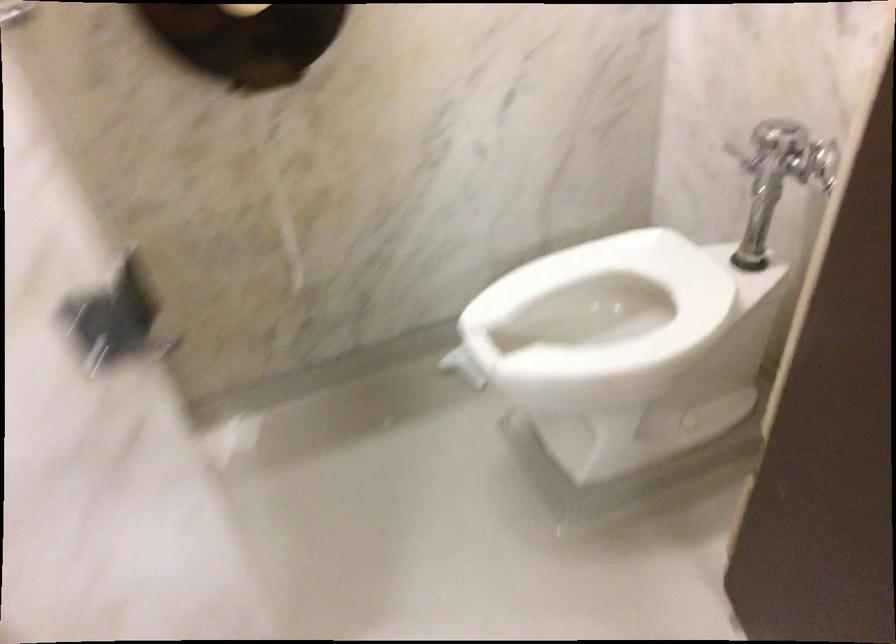
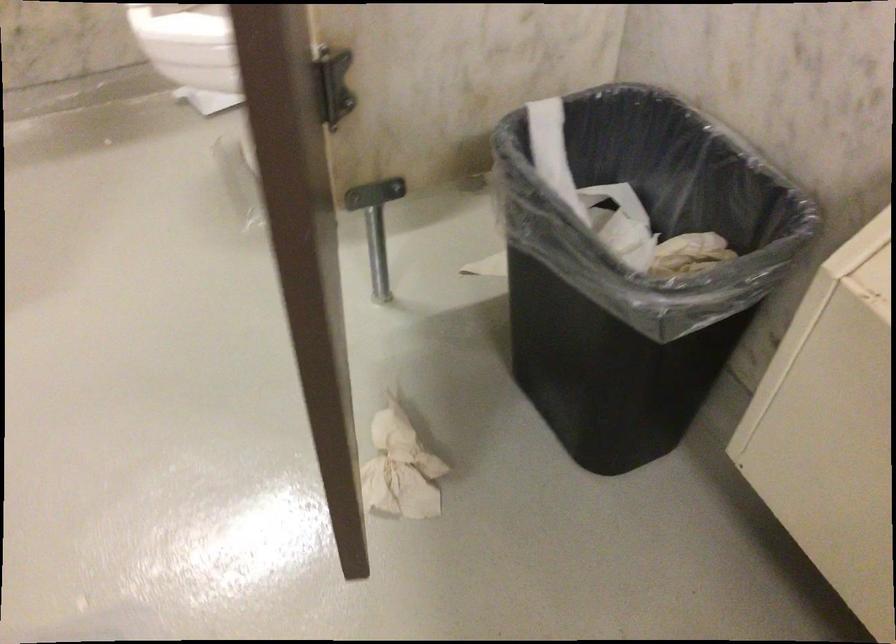
Question: What movement of the cameraman would produce the second image?

Choices:
 (A) Left
 (B) Right
 (C) Forward
 (D) Backward

Answer: (B)